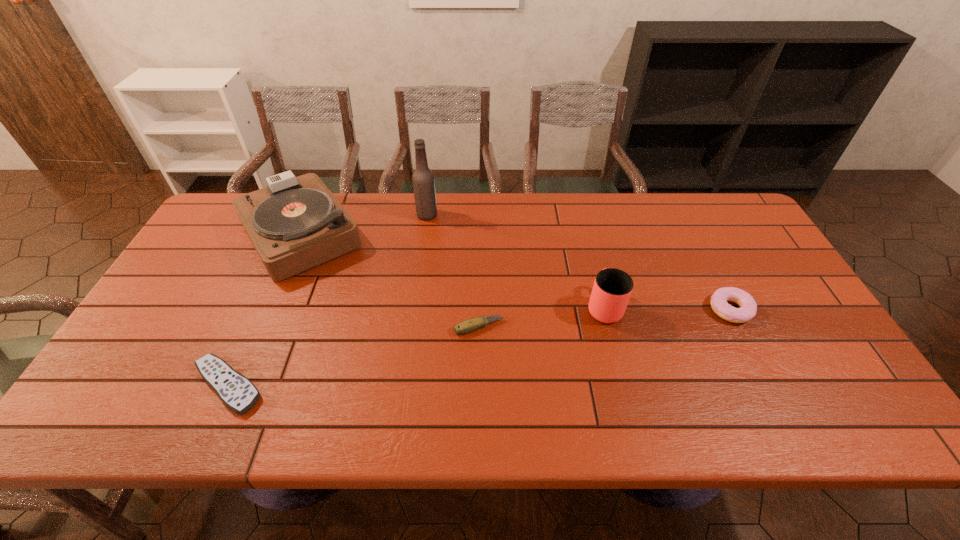
Locate an element on the screen. The width and height of the screenshot is (960, 540). free region located 0.130m on the handle side of the cup is located at coordinates (591, 255).

I want to click on vacant space situated 0.150m on the handle side of the cup, so click(589, 251).

I want to click on vacant space located on the handle side of the cup, so click(587, 240).

Identify the location of vacant area located on the back of the rightmost object. (706, 261).

Identify the location of vacant space located on the right of the third object from right to left. coord(590,327).

At what (x,y) coordinates should I click in order to perform the action: click on vacant space located on the right of the nearest object. Please return your answer as a coordinate pair (x, y). The height and width of the screenshot is (540, 960). Looking at the image, I should click on (336, 386).

This screenshot has height=540, width=960. I want to click on beer bottle positioned at the far edge, so click(x=423, y=181).

Image resolution: width=960 pixels, height=540 pixels. I want to click on record player at the far edge, so click(x=295, y=223).

Image resolution: width=960 pixels, height=540 pixels. I want to click on object present at the near edge, so click(x=237, y=392).

Image resolution: width=960 pixels, height=540 pixels. Identify the location of object positioned at the left edge. (295, 223).